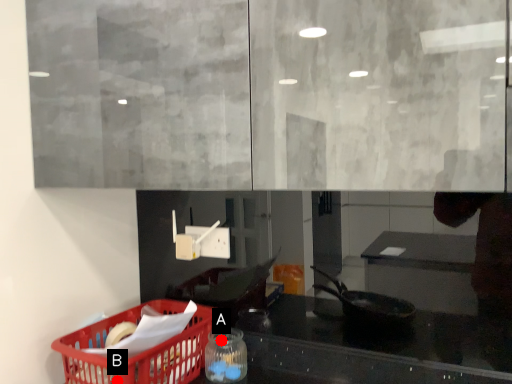
Question: Two points are circled on the image, labeled by A and B beside each circle. Which point is closer to the camera taking this photo?

Choices:
 (A) A is closer
 (B) B is closer

Answer: (B)